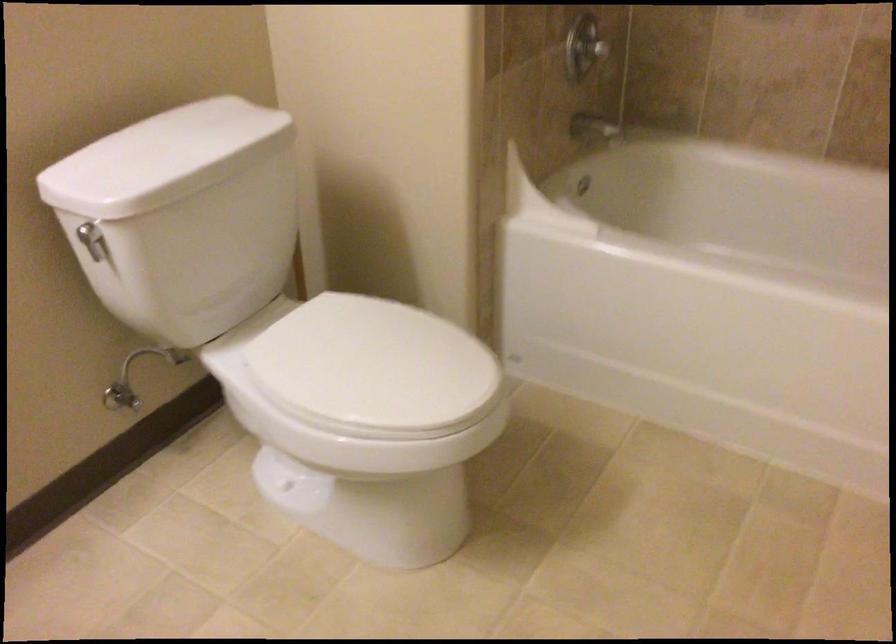
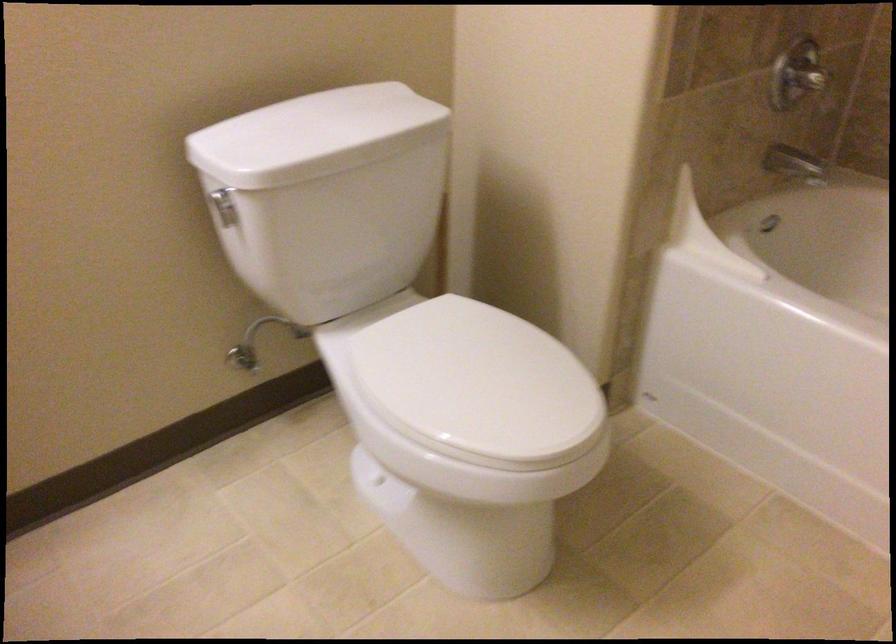
Find the pixel in the second image that matches (339,359) in the first image.

(442, 363)